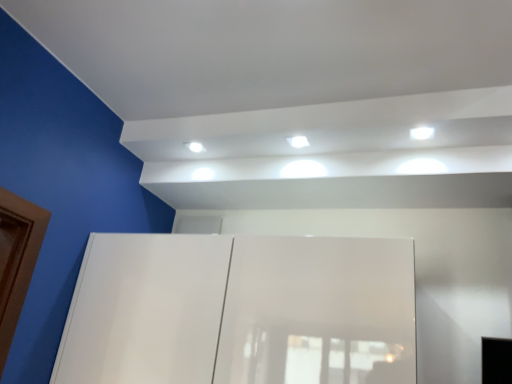
Question: From the image's perspective, is white glossy light fixture at upper center positioned above or below white glossy light at center, which is counted as the second light, starting from the right?

Choices:
 (A) below
 (B) above

Answer: (A)

Question: In terms of size, does white glossy light fixture at upper center appear bigger or smaller than white glossy light at center, which is counted as the second light, starting from the right?

Choices:
 (A) small
 (B) big

Answer: (A)

Question: Considering the real-world distances, which object is closest to the white glossy light at upper right, the 2th light in the left-to-right sequence?

Choices:
 (A) white glossy light fixture at upper center
 (B) white glossy light at center, which is counted as the second light, starting from the right

Answer: (B)

Question: Which object is the closest to the white glossy light fixture at upper center?

Choices:
 (A) white glossy light at upper right, the 2th light in the left-to-right sequence
 (B) white glossy light at center, which is counted as the second light, starting from the right

Answer: (B)